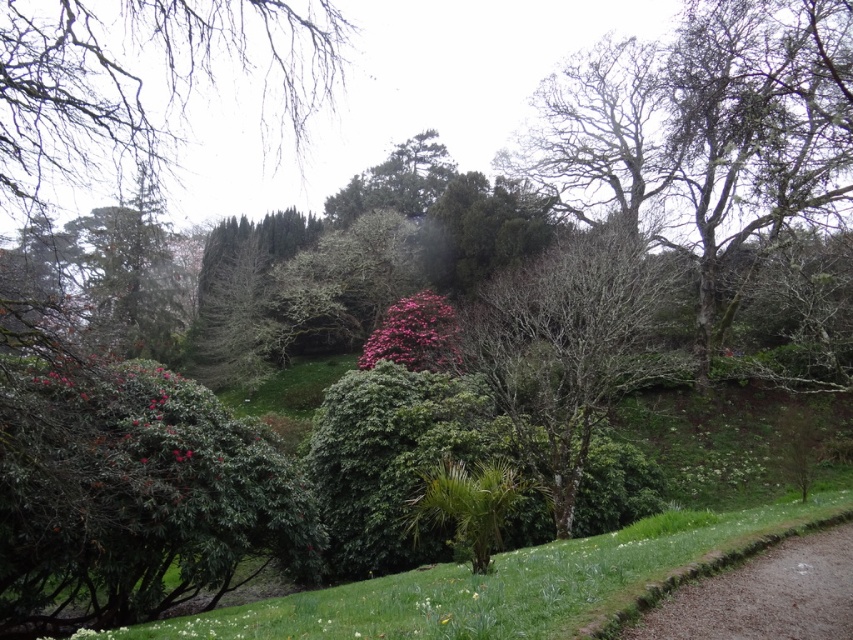
Question: Which point is closer to the camera?

Choices:
 (A) (820, 616)
 (B) (135, 108)
 (C) (434, 353)
 (D) (178, 557)

Answer: (A)

Question: Considering the relative positions of green leafy bush at lower left and pink matte flower at center in the image provided, where is green leafy bush at lower left located with respect to pink matte flower at center?

Choices:
 (A) left
 (B) right

Answer: (A)

Question: Based on their relative distances, which object is nearer to the pink matte flower at center?

Choices:
 (A) brown gravel path at lower right
 (B) bare branches at upper left

Answer: (B)

Question: In this image, where is bare branches at upper left located relative to bare bark tree at center?

Choices:
 (A) left
 (B) right

Answer: (A)

Question: Which object is positioned farthest from the brown gravel path at lower right?

Choices:
 (A) bare bark tree at center
 (B) green leafy bush at lower left
 (C) bare branches at upper left

Answer: (B)

Question: Can you confirm if bare bark tree at center is thinner than pink matte flower at center?

Choices:
 (A) yes
 (B) no

Answer: (B)